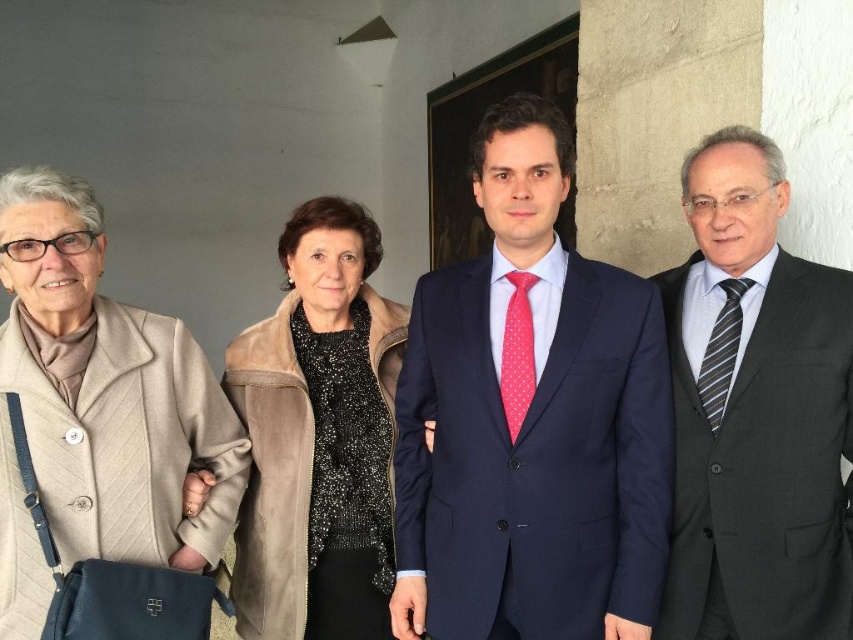
You are a fashion designer observing the group of people. You notice the navy blue suit at center and the pink dotted fabric tie at center. Which one is positioned lower in the scene?

The navy blue suit at center is positioned lower than the pink dotted fabric tie at center.

You are a photographer trying to capture a group photo of the four people. You need to ensure the suede jacket at center and the striped silk tie at right are both visible in the frame. Based on their positions, which direction should you adjust your camera to focus on both of them without cropping either out?

The suede jacket at center is positioned on the left side of the striped silk tie at right. To include both in the frame without cropping, adjust the camera slightly to the left to ensure the suede jacket at center remains visible while keeping the striped silk tie at right within the frame.

You are a photographer who wants to capture a group photo where the dark gray suit at right and the pink dotted fabric tie at center are both clearly visible. Based on their positions, which person should be positioned more to the right in the frame?

The dark gray suit at right should be positioned more to the right in the frame since it is already to the right of the pink dotted fabric tie at center.